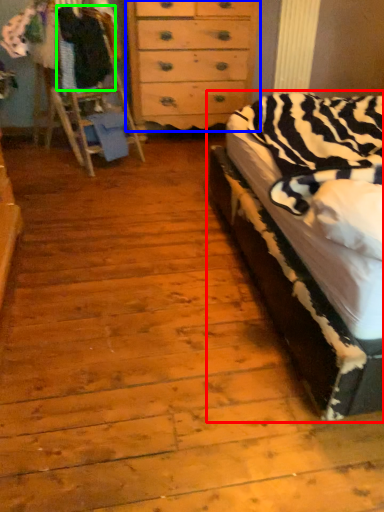
Question: Estimate the real-world distances between objects in this image. Which object is farther from bed (highlighted by a red box), chest of drawers (highlighted by a blue box) or clothing (highlighted by a green box)?

Choices:
 (A) chest of drawers
 (B) clothing

Answer: (B)